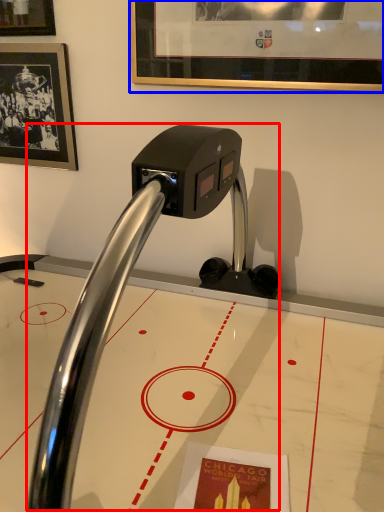
Question: Among these objects, which one is nearest to the camera, faucet (highlighted by a red box) or picture frame (highlighted by a blue box)?

Choices:
 (A) faucet
 (B) picture frame

Answer: (A)